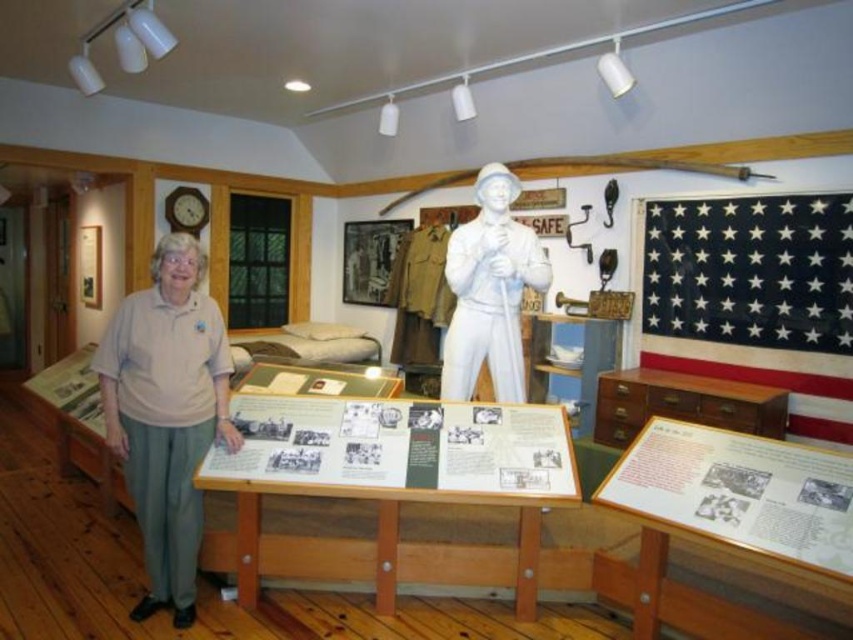
Does black cotton flag at upper right appear under white cotton shirt at left?

No.

Does black cotton flag at upper right appear on the right side of white cotton shirt at left?

Correct, you'll find black cotton flag at upper right to the right of white cotton shirt at left.

What do you see at coordinates (753, 296) in the screenshot?
I see `black cotton flag at upper right` at bounding box center [753, 296].

Where is `black cotton flag at upper right`? This screenshot has width=853, height=640. black cotton flag at upper right is located at coordinates (753, 296).

Between white cotton shirt at left and white glossy statue at center, which one appears on the left side from the viewer's perspective?

From the viewer's perspective, white cotton shirt at left appears more on the left side.

Is point (195, 240) positioned after point (506, 348)?

Yes, point (195, 240) is behind point (506, 348).

Is point (227, 417) farther from camera compared to point (456, 360)?

No, it is in front of (456, 360).

Find the location of a particular element. white cotton shirt at left is located at coordinates (166, 413).

Is black cotton flag at upper right bigger than white glossy statue at center?

Yes, black cotton flag at upper right is bigger than white glossy statue at center.

Looking at this image, measure the distance between point (804, 365) and camera.

They are 12.43 feet apart.

Who is more distant from viewer, (786, 371) or (512, 372)?

Positioned behind is point (786, 371).

Where is `black cotton flag at upper right`? The width and height of the screenshot is (853, 640). black cotton flag at upper right is located at coordinates (753, 296).